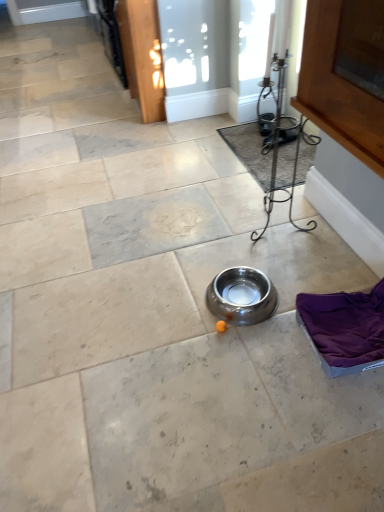
Image resolution: width=384 pixels, height=512 pixels. In order to click on empty space that is ontop of carpeted mat at center (from a real-world perspective) in this screenshot , I will do `click(279, 156)`.